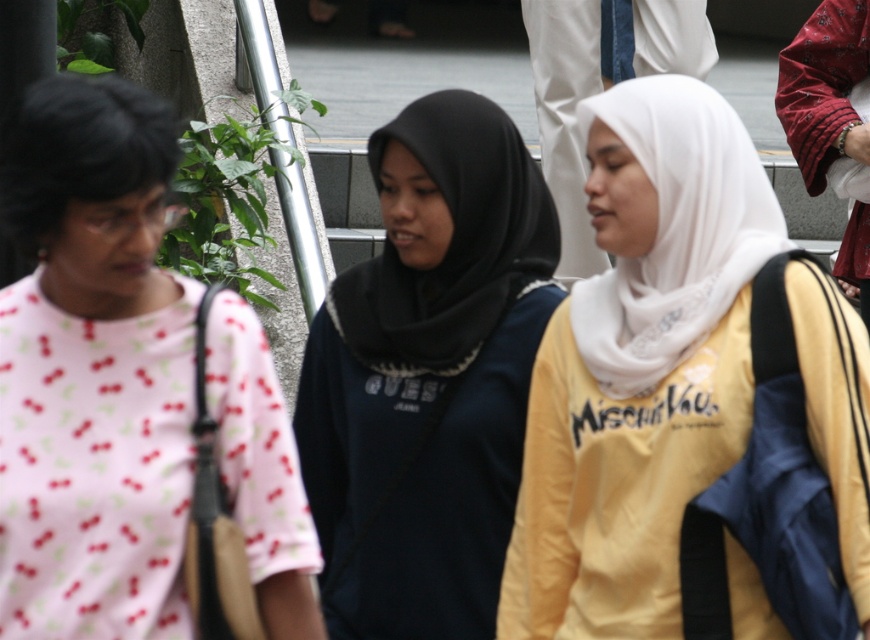
Question: Which point appears closest to the camera in this image?

Choices:
 (A) (38, 154)
 (B) (355, 616)
 (C) (659, 145)

Answer: (A)

Question: Considering the real-world distances, which object is farthest from the black matte hijab at center?

Choices:
 (A) white matte hijab at center
 (B) pink printed shirt at left

Answer: (B)

Question: Where is white matte hijab at center located in relation to black matte hijab at center in the image?

Choices:
 (A) left
 (B) right

Answer: (B)

Question: Where is pink printed shirt at left located in relation to black matte hijab at center in the image?

Choices:
 (A) below
 (B) above

Answer: (A)

Question: Can you confirm if white matte hijab at center is positioned above pink printed shirt at left?

Choices:
 (A) yes
 (B) no

Answer: (A)

Question: Which of these objects is positioned farthest from the pink printed shirt at left?

Choices:
 (A) white matte hijab at center
 (B) black matte hijab at center

Answer: (B)